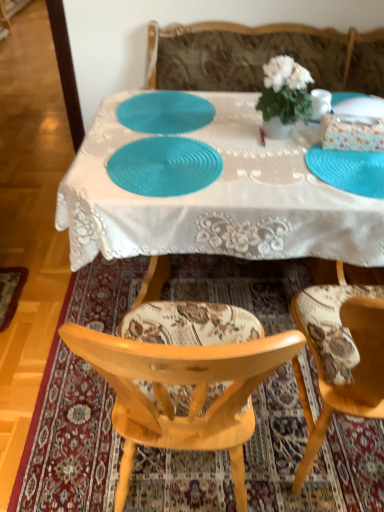
Question: Is patterned fabric chair at center smaller than floral fabric chair at lower center?

Choices:
 (A) no
 (B) yes

Answer: (A)

Question: Are patterned fabric chair at center and floral fabric chair at lower center making contact?

Choices:
 (A) no
 (B) yes

Answer: (A)

Question: Considering the relative sizes of patterned fabric chair at center and floral fabric chair at lower center in the image provided, is patterned fabric chair at center wider than floral fabric chair at lower center?

Choices:
 (A) yes
 (B) no

Answer: (B)

Question: Is patterned fabric chair at center shorter than floral fabric chair at lower center?

Choices:
 (A) no
 (B) yes

Answer: (A)

Question: Considering the relative positions of patterned fabric chair at center and floral fabric chair at lower center in the image provided, is patterned fabric chair at center in front of floral fabric chair at lower center?

Choices:
 (A) yes
 (B) no

Answer: (A)

Question: Is patterned fabric chair at center behind floral fabric chair at lower center?

Choices:
 (A) no
 (B) yes

Answer: (A)

Question: Does blue textured placemat at center, the 1th plate positioned from the left, come behind camouflage fabric couch at center?

Choices:
 (A) yes
 (B) no

Answer: (B)

Question: Is blue textured placemat at center, which is counted as the 3th plate, starting from the right, thinner than camouflage fabric couch at center?

Choices:
 (A) no
 (B) yes

Answer: (B)

Question: Is blue textured placemat at center, which is counted as the 3th plate, starting from the right, turned away from camouflage fabric couch at center?

Choices:
 (A) no
 (B) yes

Answer: (A)

Question: From a real-world perspective, is blue textured placemat at center, the 1th plate positioned from the left, beneath camouflage fabric couch at center?

Choices:
 (A) no
 (B) yes

Answer: (A)

Question: Is blue textured placemat at center, which is counted as the 3th plate, starting from the right, at the left side of camouflage fabric couch at center?

Choices:
 (A) no
 (B) yes

Answer: (B)

Question: Is blue textured placemat at center, which is counted as the 3th plate, starting from the right, far from camouflage fabric couch at center?

Choices:
 (A) yes
 (B) no

Answer: (B)

Question: Considering the relative positions of teal textured plate at center, acting as the second plate starting from the right, and blue textured placemat at center, the 1th plate positioned from the left, in the image provided, is teal textured plate at center, acting as the second plate starting from the right, to the left of blue textured placemat at center, the 1th plate positioned from the left, from the viewer's perspective?

Choices:
 (A) no
 (B) yes

Answer: (A)